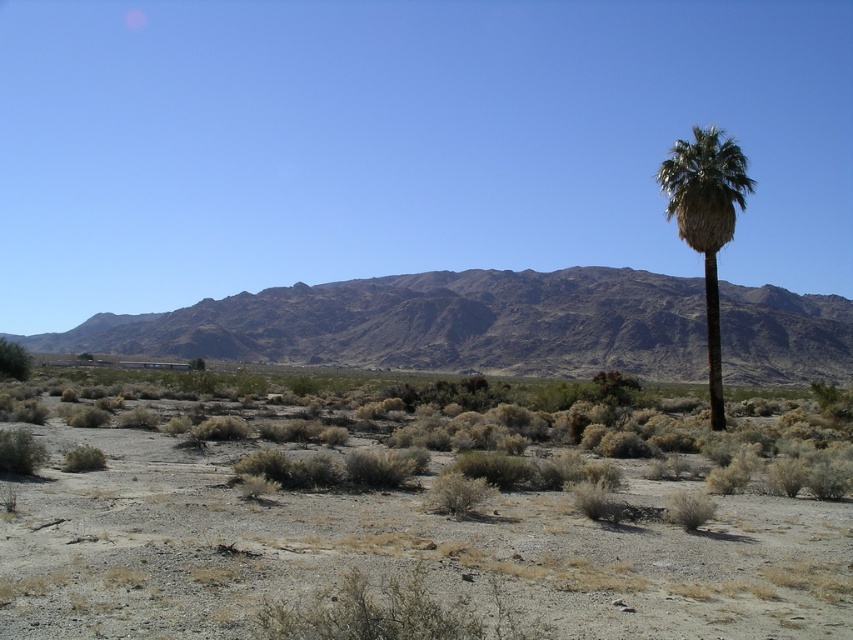
You are an environmental scientist studying desert vegetation. You observe the green leafy palm at right and the green leafy bush at lower left in the image. Which of these two plants is taller?

The green leafy palm at right is taller than the green leafy bush at lower left.

You are standing in the desert scene described. You see the dark brown rocky mountain range at center. Based on its position, can you determine if it is closer to the top or bottom of the image?

The dark brown rocky mountain range at center is located at the point with coordinates (431,323), which places it exactly at the center of the image. Therefore, it is neither closer to the top nor the bottom.

You are standing at the center of the desert scene. You see the green leafy palm at right and the green leafy bush at lower left. Which of these two plants is positioned higher up in the image?

The green leafy palm at right is located above the green leafy bush at lower left in the image.